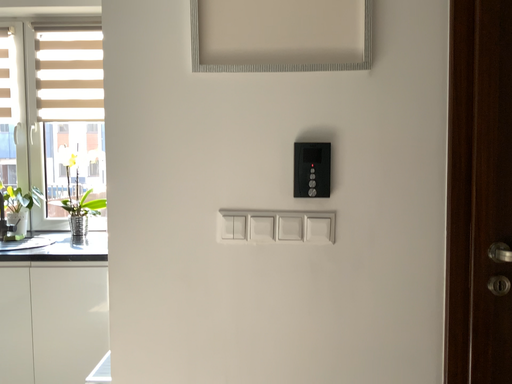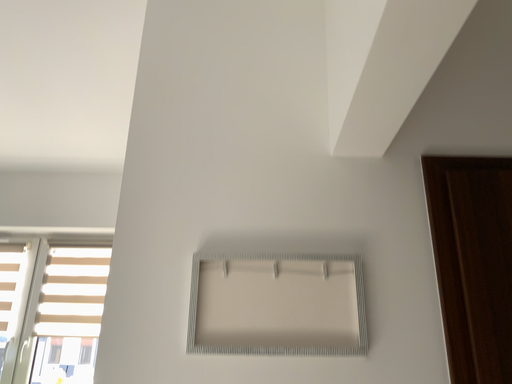
Question: How did the camera likely rotate when shooting the video?

Choices:
 (A) rotated upward
 (B) rotated downward

Answer: (A)